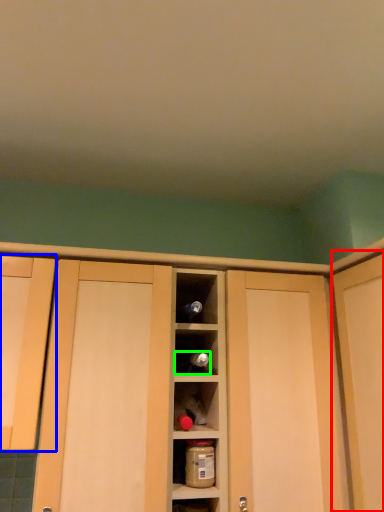
Question: Which object is the farthest from door (highlighted by a red box)? Choose among these: cabinetry (highlighted by a blue box) or wine bottle (highlighted by a green box).

Choices:
 (A) cabinetry
 (B) wine bottle

Answer: (A)